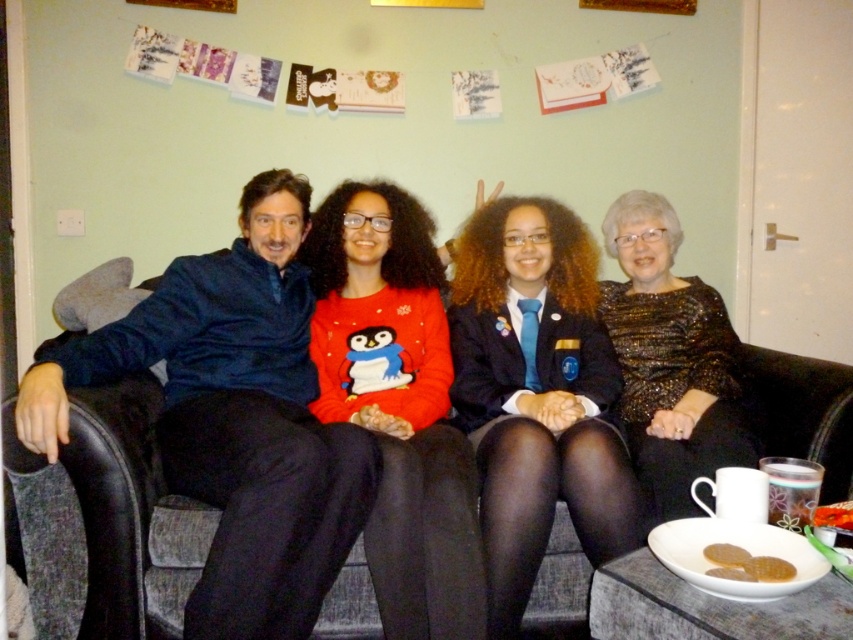
Question: Observing the image, what is the correct spatial positioning of matte red sweater at center in reference to sparkly gold dress at center?

Choices:
 (A) right
 (B) left

Answer: (B)

Question: Which object is farther from the camera taking this photo?

Choices:
 (A) dark gray fabric couch at center
 (B) sparkly gold dress at center
 (C) blue satin blazer at center

Answer: (B)

Question: Is matte red sweater at center thinner than sparkly gold dress at center?

Choices:
 (A) yes
 (B) no

Answer: (B)

Question: Is blue satin blazer at center positioned behind sparkly gold dress at center?

Choices:
 (A) yes
 (B) no

Answer: (B)

Question: Which object appears farthest from the camera in this image?

Choices:
 (A) blue satin blazer at center
 (B) dark gray fabric couch at center

Answer: (A)

Question: Based on their relative distances, which object is nearer to the blue satin blazer at center?

Choices:
 (A) sparkly gold dress at center
 (B) blue fleece jacket at left
 (C) dark gray fabric couch at center
 (D) matte red sweater at center

Answer: (D)